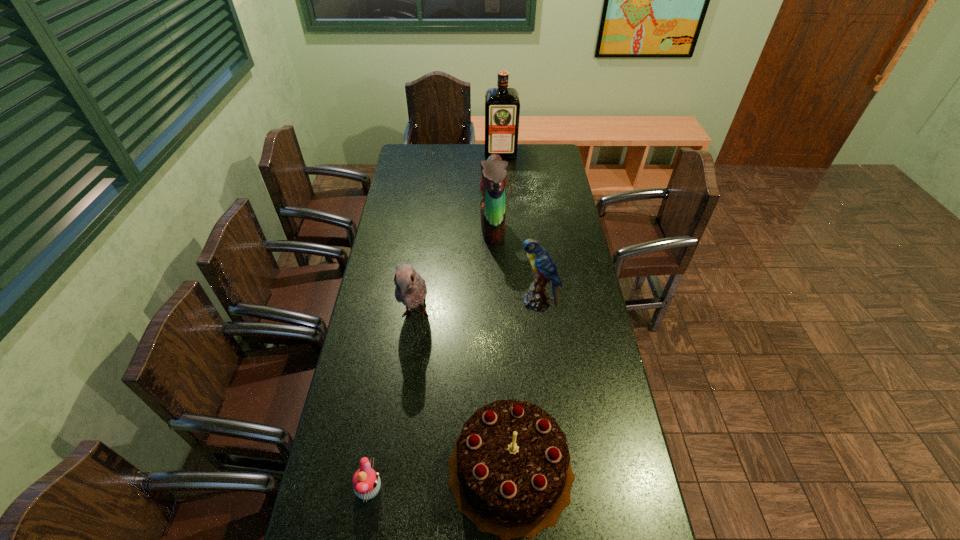
Find the location of a particular element. Image resolution: width=960 pixels, height=540 pixels. the farthest object is located at coordinates (502, 105).

Locate an element on the screen. The image size is (960, 540). the tallest object is located at coordinates (502, 105).

Image resolution: width=960 pixels, height=540 pixels. I want to click on the farthest parrot, so click(x=493, y=184).

Identify the location of the second farthest object. This screenshot has height=540, width=960. (493, 184).

The image size is (960, 540). I want to click on the rightmost parrot, so click(536, 299).

Identify the location of the leftmost parrot. (411, 290).

At what (x,y) coordinates should I click in order to perform the action: click on the shortest object. Please return your answer as a coordinate pair (x, y). Looking at the image, I should click on (366, 483).

Where is `vacant position located on the front label of the liquor`? vacant position located on the front label of the liquor is located at coordinates (502, 181).

You are a GUI agent. You are given a task and a screenshot of the screen. Output one action in this format:
    pyautogui.click(x=<x>, y=<y>)
    Task: Click on the free spot located at the face of the second parrot from left to right
    Image resolution: width=960 pixels, height=540 pixels.
    Given the screenshot: What is the action you would take?
    pyautogui.click(x=419, y=228)

Identify the location of vacant space located 0.250m at the face of the second parrot from left to right. The width and height of the screenshot is (960, 540). (421, 228).